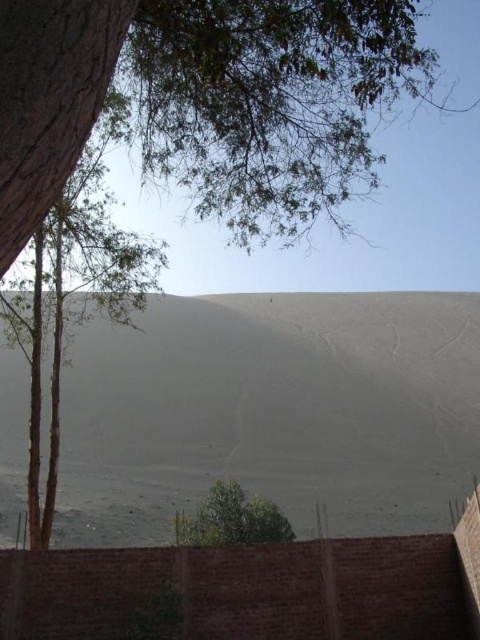
Looking at this image, you are standing at the brick wall with metal bars in the foreground of the sandy dune scene. You notice two points marked on the dune surface. The first point is at coordinate [302,536] and the second at [40,259]. From your vantage point at the wall, which point appears closer to you?

Point [40,259] appears closer because it is in front of point 0.831, 0.631, which is behind it according to their spatial relationship.

You are standing at the center of the sandy dune in the image. Which direction should you walk to reach the green leafy tree at left?

The green leafy tree at left is located at coordinates 0.450 on the x axis and 0.156 on the y axis. Since you are at the center of the dune, which is at coordinates 0.5 on the x axis and 0.5 on the y axis, you should walk northwest to reach the green leafy tree at left.

Looking at this image, you are standing at the base of the sandy dune and want to reach the point marked at coordinates (x=462, y=348). Given that the distance between you and the point is 50.87 meters, will you need to walk more than 50 meters to get there?

The point at (x=462, y=348) is 50.87 meters away from you, so yes, you will need to walk more than 50 meters to reach it.